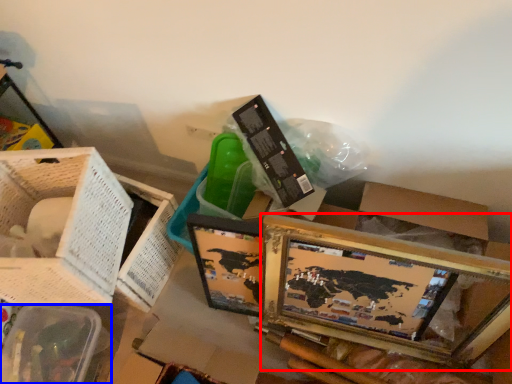
Question: Which object is closer to the camera taking this photo, picture frame (highlighted by a red box) or basket (highlighted by a blue box)?

Choices:
 (A) picture frame
 (B) basket

Answer: (A)